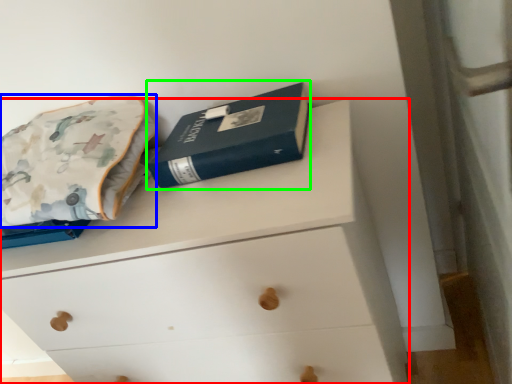
Question: Which is farther away from chest of drawers (highlighted by a red box)? throw pillow (highlighted by a blue box) or paperback book (highlighted by a green box)?

Choices:
 (A) throw pillow
 (B) paperback book

Answer: (A)